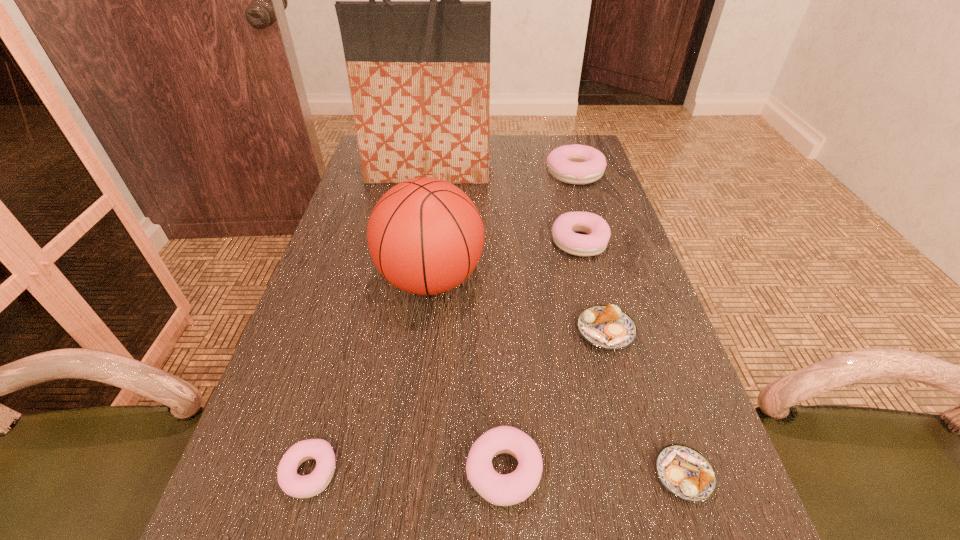
The width and height of the screenshot is (960, 540). Find the location of `the tallest object`. the tallest object is located at coordinates (419, 71).

Identify the location of the second tallest object. The width and height of the screenshot is (960, 540). (425, 235).

At what (x,y) coordinates should I click in order to perform the action: click on the third tallest object. Please return your answer as a coordinate pair (x, y). Image resolution: width=960 pixels, height=540 pixels. Looking at the image, I should click on (577, 164).

This screenshot has height=540, width=960. What are the coordinates of `the farthest pink pastry` in the screenshot? It's located at (577, 164).

Locate an element on the screen. This screenshot has width=960, height=540. the fifth shortest object is located at coordinates (563, 231).

This screenshot has height=540, width=960. I want to click on the third smallest pink pastry, so click(x=563, y=231).

You are a GUI agent. You are given a task and a screenshot of the screen. Output one action in this format:
    pyautogui.click(x=<x>, y=<y>)
    Task: Click on the fifth pastry from right to left
    Image resolution: width=960 pixels, height=540 pixels.
    Given the screenshot: What is the action you would take?
    pyautogui.click(x=503, y=490)

Where is `the second smallest pink pastry`? Image resolution: width=960 pixels, height=540 pixels. the second smallest pink pastry is located at coordinates (503, 490).

Identify the location of the bigger brown pastry. This screenshot has width=960, height=540. click(606, 327).

This screenshot has height=540, width=960. What are the coordinates of `the fourth nearest pastry` in the screenshot? It's located at (606, 327).